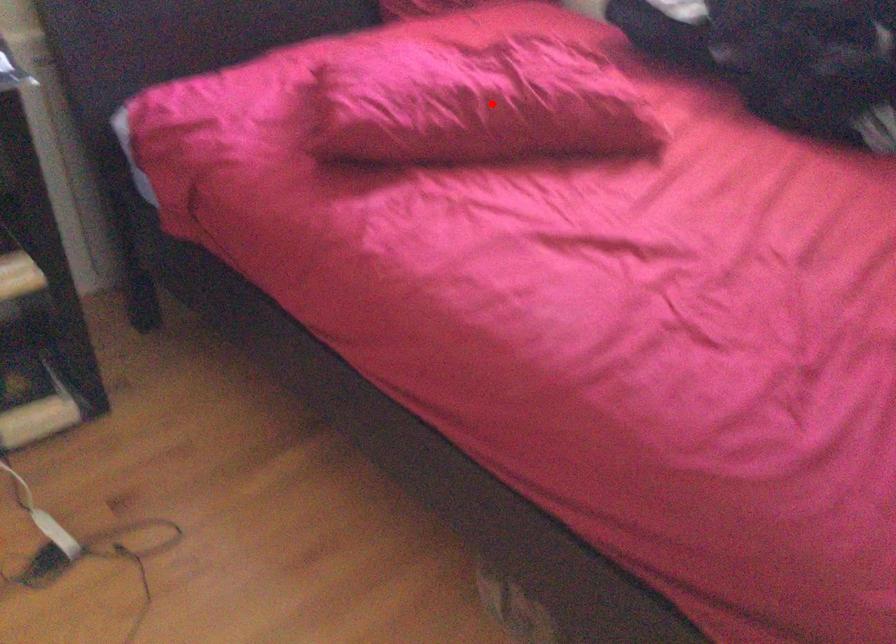
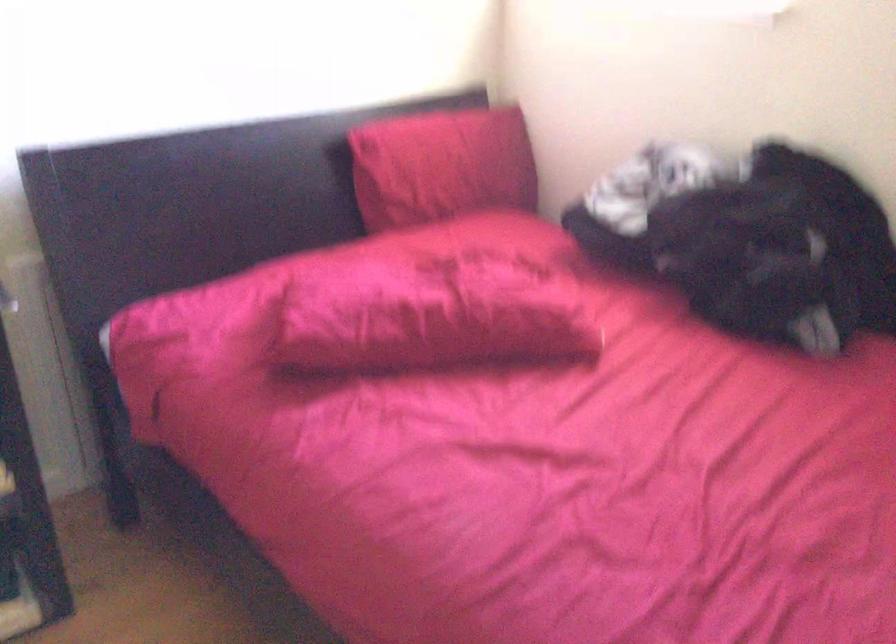
Where in the second image is the point corresponding to the highlighted location from the first image?

(431, 316)